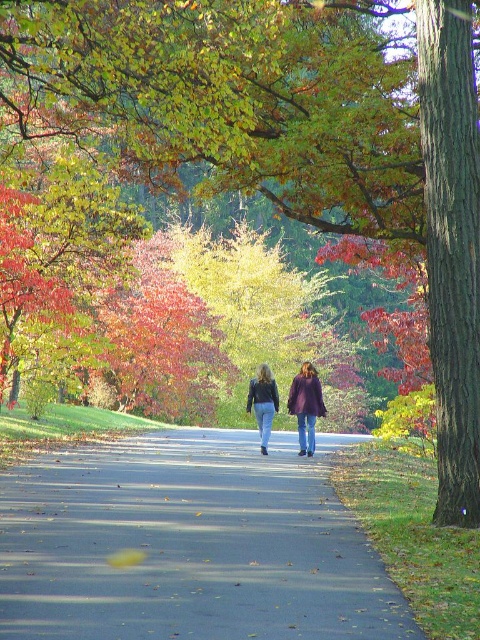
Is the position of asphalt road at center more distant than that of matte purple coat at center?

No, asphalt road at center is in front of matte purple coat at center.

Who is more forward, (x=33, y=493) or (x=312, y=449)?

Positioned in front is point (x=33, y=493).

The image size is (480, 640). Find the location of `asphalt road at center`. asphalt road at center is located at coordinates (190, 545).

Is purple matte coat at center further to camera compared to jeans at center?

Yes, it is.

Who is more forward, (295,385) or (263,426)?

Positioned in front is point (263,426).

Where is `purple matte coat at center`? purple matte coat at center is located at coordinates (305, 404).

Is point (453, 336) in front of point (322, 401)?

Yes, point (453, 336) is in front of point (322, 401).

What do you see at coordinates (452, 248) in the screenshot? I see `smooth bark tree at right` at bounding box center [452, 248].

Is point (463, 189) closer to camera compared to point (310, 388)?

That is True.

At what (x,y) coordinates should I click in order to perform the action: click on smooth bark tree at right. Please return your answer as a coordinate pair (x, y). This screenshot has height=640, width=480. Looking at the image, I should click on (452, 248).